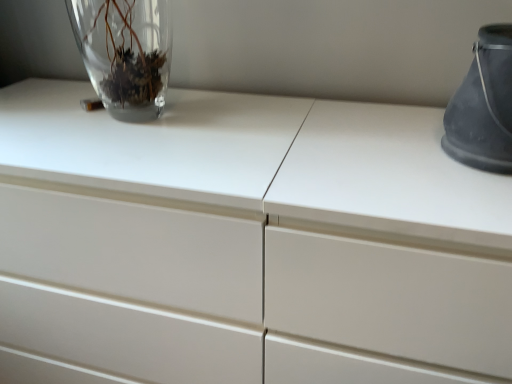
How much space does matte gray bucket at right, marked as the 2th vase in a left-to-right arrangement, occupy horizontally?

The width of matte gray bucket at right, marked as the 2th vase in a left-to-right arrangement, is 17.23 centimeters.

The image size is (512, 384). Describe the element at coordinates (484, 105) in the screenshot. I see `matte gray bucket at right, marked as the 2th vase in a left-to-right arrangement` at that location.

At what (x,y) coordinates should I click in order to perform the action: click on matte gray bucket at right, marked as the 2th vase in a left-to-right arrangement. Please return your answer as a coordinate pair (x, y). This screenshot has height=384, width=512. Looking at the image, I should click on (484, 105).

Measure the distance between matte gray bucket at right, placed as the first vase when sorted from right to left, and camera.

matte gray bucket at right, placed as the first vase when sorted from right to left, and camera are 23.71 inches apart.

What do you see at coordinates (125, 53) in the screenshot?
I see `transparent glass vase at upper left, which is counted as the 2th vase, starting from the right` at bounding box center [125, 53].

The height and width of the screenshot is (384, 512). In order to click on transparent glass vase at upper left, which is counted as the 2th vase, starting from the right in this screenshot , I will do `click(125, 53)`.

Find the location of `matte gray bucket at right, marked as the 2th vase in a left-to-right arrangement`. matte gray bucket at right, marked as the 2th vase in a left-to-right arrangement is located at coordinates (484, 105).

Can you confirm if transparent glass vase at upper left, which is counted as the 2th vase, starting from the right, is positioned to the right of matte gray bucket at right, placed as the first vase when sorted from right to left?

No, transparent glass vase at upper left, which is counted as the 2th vase, starting from the right, is not to the right of matte gray bucket at right, placed as the first vase when sorted from right to left.

Relative to matte gray bucket at right, placed as the first vase when sorted from right to left, is transparent glass vase at upper left, which is counted as the 2th vase, starting from the right, in front or behind?

transparent glass vase at upper left, which is counted as the 2th vase, starting from the right, is positioned farther from the viewer than matte gray bucket at right, placed as the first vase when sorted from right to left.

Considering the positions of points (111, 57) and (490, 157), is point (111, 57) closer to camera compared to point (490, 157)?

No, (111, 57) is behind (490, 157).

From the image's perspective, is transparent glass vase at upper left, which is counted as the 2th vase, starting from the right, below matte gray bucket at right, marked as the 2th vase in a left-to-right arrangement?

Actually, transparent glass vase at upper left, which is counted as the 2th vase, starting from the right, appears above matte gray bucket at right, marked as the 2th vase in a left-to-right arrangement, in the image.

From a real-world perspective, between transparent glass vase at upper left, marked as the 1th vase in a left-to-right arrangement, and matte gray bucket at right, placed as the first vase when sorted from right to left, who is vertically higher?

From a 3D spatial view, transparent glass vase at upper left, marked as the 1th vase in a left-to-right arrangement, is above.

In terms of width, does transparent glass vase at upper left, marked as the 1th vase in a left-to-right arrangement, look wider or thinner when compared to matte gray bucket at right, marked as the 2th vase in a left-to-right arrangement?

transparent glass vase at upper left, marked as the 1th vase in a left-to-right arrangement, is thinner than matte gray bucket at right, marked as the 2th vase in a left-to-right arrangement.

From their relative heights in the image, would you say transparent glass vase at upper left, marked as the 1th vase in a left-to-right arrangement, is taller or shorter than matte gray bucket at right, marked as the 2th vase in a left-to-right arrangement?

Clearly, transparent glass vase at upper left, marked as the 1th vase in a left-to-right arrangement, is taller compared to matte gray bucket at right, marked as the 2th vase in a left-to-right arrangement.

Can you confirm if transparent glass vase at upper left, which is counted as the 2th vase, starting from the right, is smaller than matte gray bucket at right, marked as the 2th vase in a left-to-right arrangement?

Correct, transparent glass vase at upper left, which is counted as the 2th vase, starting from the right, occupies less space than matte gray bucket at right, marked as the 2th vase in a left-to-right arrangement.

Is transparent glass vase at upper left, which is counted as the 2th vase, starting from the right, spatially inside matte gray bucket at right, marked as the 2th vase in a left-to-right arrangement, or outside of it?

transparent glass vase at upper left, which is counted as the 2th vase, starting from the right, is outside matte gray bucket at right, marked as the 2th vase in a left-to-right arrangement.

Is transparent glass vase at upper left, which is counted as the 2th vase, starting from the right, with matte gray bucket at right, marked as the 2th vase in a left-to-right arrangement?

They are not placed beside each other.

Is transparent glass vase at upper left, which is counted as the 2th vase, starting from the right, facing away from matte gray bucket at right, placed as the first vase when sorted from right to left?

That's not correct — transparent glass vase at upper left, which is counted as the 2th vase, starting from the right, is not looking away from matte gray bucket at right, placed as the first vase when sorted from right to left.

In the scene shown: What's the angular difference between transparent glass vase at upper left, which is counted as the 2th vase, starting from the right, and matte gray bucket at right, placed as the first vase when sorted from right to left,'s facing directions?

The angular difference between transparent glass vase at upper left, which is counted as the 2th vase, starting from the right, and matte gray bucket at right, placed as the first vase when sorted from right to left, is 3.46 degrees.

Where is `vase that is under the transparent glass vase at upper left, which is counted as the 2th vase, starting from the right (from a real-world perspective)`? vase that is under the transparent glass vase at upper left, which is counted as the 2th vase, starting from the right (from a real-world perspective) is located at coordinates (484, 105).

Which is more to the right, matte gray bucket at right, placed as the first vase when sorted from right to left, or transparent glass vase at upper left, which is counted as the 2th vase, starting from the right?

Positioned to the right is matte gray bucket at right, placed as the first vase when sorted from right to left.

Which object is closer to the camera taking this photo, matte gray bucket at right, placed as the first vase when sorted from right to left, or transparent glass vase at upper left, which is counted as the 2th vase, starting from the right?

matte gray bucket at right, placed as the first vase when sorted from right to left.

Does point (451, 135) lie in front of point (163, 15)?

That is True.

From the image's perspective, is matte gray bucket at right, placed as the first vase when sorted from right to left, above transparent glass vase at upper left, marked as the 1th vase in a left-to-right arrangement?

No, from the image's perspective, matte gray bucket at right, placed as the first vase when sorted from right to left, is not above transparent glass vase at upper left, marked as the 1th vase in a left-to-right arrangement.

From a real-world perspective, is matte gray bucket at right, marked as the 2th vase in a left-to-right arrangement, below transparent glass vase at upper left, marked as the 1th vase in a left-to-right arrangement?

Indeed, from a real-world perspective, matte gray bucket at right, marked as the 2th vase in a left-to-right arrangement, is positioned beneath transparent glass vase at upper left, marked as the 1th vase in a left-to-right arrangement.

Does matte gray bucket at right, marked as the 2th vase in a left-to-right arrangement, have a greater width compared to transparent glass vase at upper left, marked as the 1th vase in a left-to-right arrangement?

Yes.

Between matte gray bucket at right, marked as the 2th vase in a left-to-right arrangement, and transparent glass vase at upper left, which is counted as the 2th vase, starting from the right, which one has less height?

With less height is matte gray bucket at right, marked as the 2th vase in a left-to-right arrangement.

In the scene shown: Considering the relative sizes of matte gray bucket at right, placed as the first vase when sorted from right to left, and transparent glass vase at upper left, marked as the 1th vase in a left-to-right arrangement, in the image provided, is matte gray bucket at right, placed as the first vase when sorted from right to left, bigger than transparent glass vase at upper left, marked as the 1th vase in a left-to-right arrangement,?

Yes.

Would you say matte gray bucket at right, marked as the 2th vase in a left-to-right arrangement, is outside transparent glass vase at upper left, which is counted as the 2th vase, starting from the right?

Absolutely, matte gray bucket at right, marked as the 2th vase in a left-to-right arrangement, is external to transparent glass vase at upper left, which is counted as the 2th vase, starting from the right.

Is matte gray bucket at right, placed as the first vase when sorted from right to left, next to transparent glass vase at upper left, marked as the 1th vase in a left-to-right arrangement, and touching it?

matte gray bucket at right, placed as the first vase when sorted from right to left, and transparent glass vase at upper left, marked as the 1th vase in a left-to-right arrangement, are clearly separated.

Is matte gray bucket at right, marked as the 2th vase in a left-to-right arrangement, turned away from transparent glass vase at upper left, which is counted as the 2th vase, starting from the right?

No, matte gray bucket at right, marked as the 2th vase in a left-to-right arrangement, is not facing the opposite direction of transparent glass vase at upper left, which is counted as the 2th vase, starting from the right.

How different are the orientations of matte gray bucket at right, placed as the first vase when sorted from right to left, and transparent glass vase at upper left, which is counted as the 2th vase, starting from the right, in degrees?

3.46 degrees.

Image resolution: width=512 pixels, height=384 pixels. I want to click on vase that is above the matte gray bucket at right, marked as the 2th vase in a left-to-right arrangement (from the image's perspective), so click(125, 53).

Identify the location of vase below the transparent glass vase at upper left, marked as the 1th vase in a left-to-right arrangement (from a real-world perspective). The height and width of the screenshot is (384, 512). (484, 105).

Locate an element on the screen. vase in front of the transparent glass vase at upper left, marked as the 1th vase in a left-to-right arrangement is located at coordinates (484, 105).